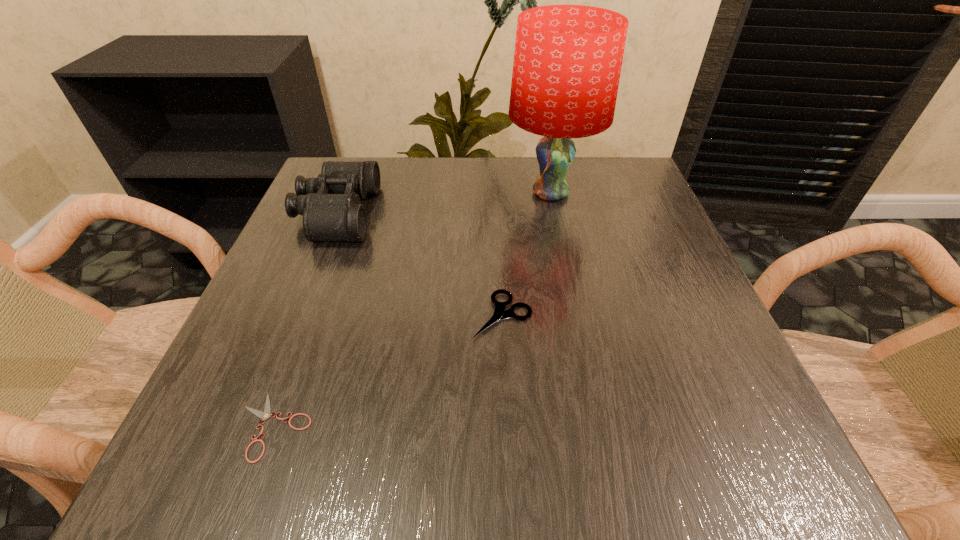
Locate an element on the screen. blank space at the near edge is located at coordinates coord(495,467).

Locate an element on the screen. The image size is (960, 540). free space at the left edge of the desktop is located at coordinates (298, 318).

You are a GUI agent. You are given a task and a screenshot of the screen. Output one action in this format:
    pyautogui.click(x=<x>, y=<y>)
    Task: Click on the free region at the right edge of the desktop
    This screenshot has width=960, height=540.
    Given the screenshot: What is the action you would take?
    pyautogui.click(x=656, y=292)

The height and width of the screenshot is (540, 960). In the image, there is a desktop. In order to click on vacant area at the far left corner in this screenshot , I will do `click(389, 166)`.

I want to click on vacant space at the far right corner of the desktop, so click(x=618, y=206).

This screenshot has height=540, width=960. Find the location of `vacant point located between the binoculars and the nearest object`. vacant point located between the binoculars and the nearest object is located at coordinates (305, 320).

Locate an element on the screen. This screenshot has width=960, height=540. blank region between the taller shears and the lampshade is located at coordinates (526, 254).

In order to click on free space between the nearer shears and the lampshade in this screenshot , I will do `click(412, 310)`.

This screenshot has height=540, width=960. What are the coordinates of `unoccupied position between the binoculars and the shorter shears` in the screenshot? It's located at (305, 320).

This screenshot has height=540, width=960. What are the coordinates of `free area in between the binoculars and the taller shears` in the screenshot? It's located at (420, 265).